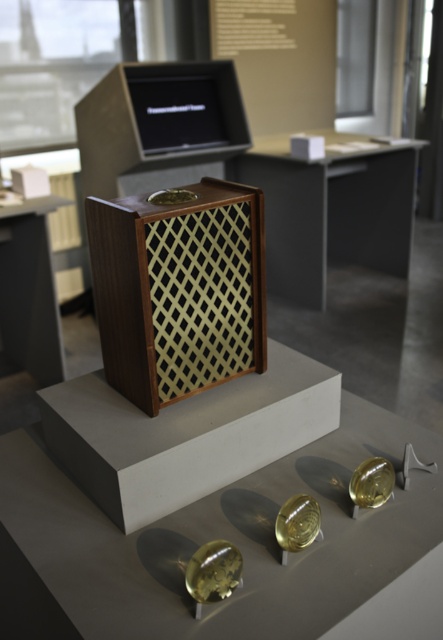
You are an event planner setting up a display. The main wooden box is placed at the center of the exhibition space. You need to place a decorative item exactly at the center of the matte wood table at center. Where should you place it?

The decorative item should be placed at the center of the matte wood table at center, which is located at point [330,209].

You are standing in front of the display setup and want to reach the point at the bottom of the image. Which of the two points, point at point [334,227] or point at point [31,234], is closer to you?

Point at point [31,234] is closer to you because it is located at the bottom of the image, while point at point [334,227] is behind it.